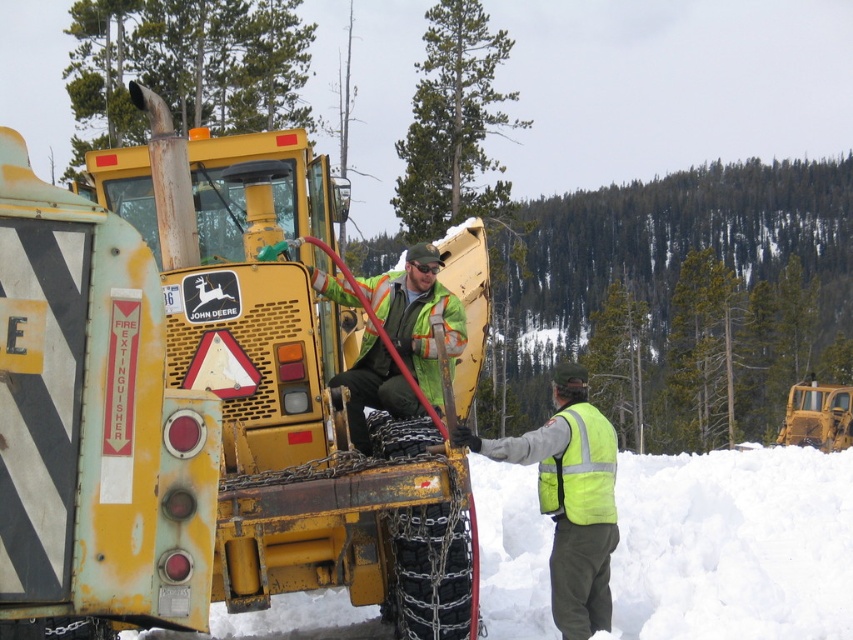
Is white fluffy snow at lower right positioned in front of high-visibility yellow safety vest at center-right?

Yes, white fluffy snow at lower right is in front of high-visibility yellow safety vest at center-right.

Which is behind, point (815, 497) or point (560, 460)?

Point (815, 497)

Locate an element on the screen. The image size is (853, 640). white fluffy snow at lower right is located at coordinates (733, 545).

Is yellow matte tractor at center to the right of high-visibility yellow safety vest at center-right from the viewer's perspective?

In fact, yellow matte tractor at center is to the left of high-visibility yellow safety vest at center-right.

Can you confirm if yellow matte tractor at center is shorter than high-visibility yellow safety vest at center-right?

No.

Does point (341, 204) come farther from viewer compared to point (556, 476)?

Yes, it is behind point (556, 476).

Where is `yellow matte tractor at center`? Image resolution: width=853 pixels, height=640 pixels. yellow matte tractor at center is located at coordinates (186, 408).

Does point (302, 198) lie in front of point (556, 600)?

No.

Does yellow matte tractor at center appear on the left side of yellow reflective vest at right?

Indeed, yellow matte tractor at center is positioned on the left side of yellow reflective vest at right.

The image size is (853, 640). What do you see at coordinates (186, 408) in the screenshot?
I see `yellow matte tractor at center` at bounding box center [186, 408].

The image size is (853, 640). In order to click on yellow matte tractor at center in this screenshot , I will do `click(186, 408)`.